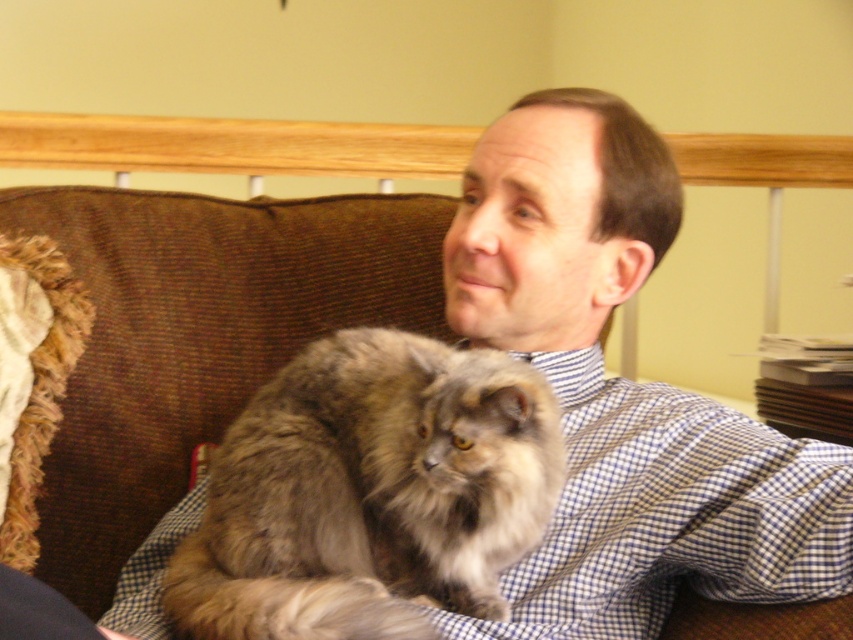
You are a delivery person who needs to place a small package between the brown corduroy couch at upper left and the fuzzy brown cat at center. Can you fit the package there if it measures 16 inches in length?

The distance between the brown corduroy couch at upper left and the fuzzy brown cat at center is 15.96 inches. Since the package is 16 inches long, it won

You are trying to decide if the brown corduroy couch at upper left can fit through a doorway that is narrower than the fuzzy brown cat at center. Based on their sizes, would the couch be too wide to pass through?

The brown corduroy couch at upper left might be wider than the fuzzy brown cat at center, so there is a possibility that the couch would be too wide to fit through the doorway if the doorway is narrower than the cat.